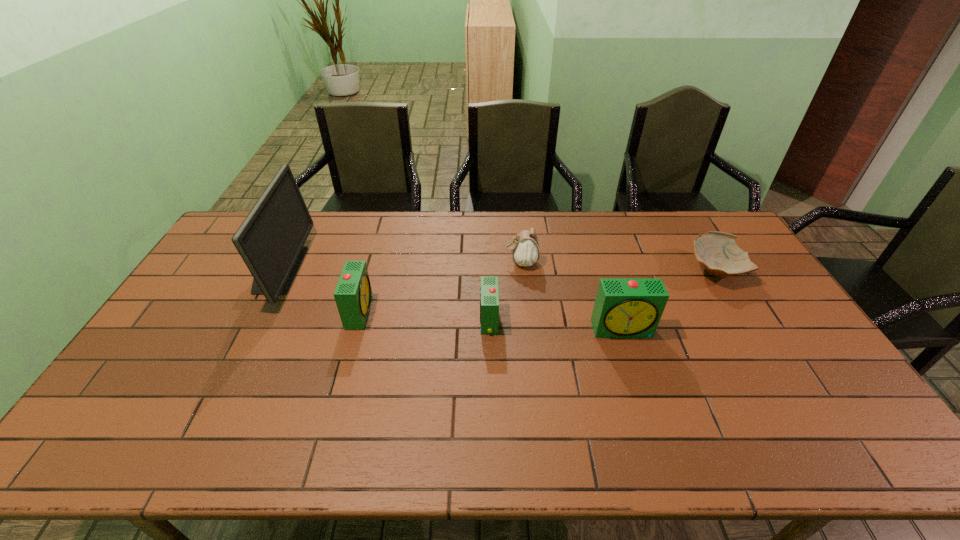
What are the coordinates of `free spot between the shortest alarm clock and the tallest object` in the screenshot? It's located at tap(383, 295).

Identify the location of free spot between the rightmost object and the fifth object from right to left. [x=538, y=291].

I want to click on vacant area that lies between the shortest alarm clock and the pouch, so click(x=505, y=291).

Locate an element on the screen. free space between the second alarm clock from left to right and the rightmost alarm clock is located at coordinates (556, 325).

Where is `object that is the third closest to the leftmost alarm clock`? This screenshot has height=540, width=960. object that is the third closest to the leftmost alarm clock is located at coordinates (525, 247).

Locate which object is the second closest to the tallest object. Please provide its 2D coordinates. Your answer should be formatted as a tuple, i.e. [(x, y)], where the tuple contains the x and y coordinates of a point satisfying the conditions above.

[(489, 294)]

This screenshot has width=960, height=540. I want to click on alarm clock that is the closest one to the shortest alarm clock, so 624,307.

Select which alarm clock is the second closest to the second object from right to left. Please provide its 2D coordinates. Your answer should be formatted as a tuple, i.e. [(x, y)], where the tuple contains the x and y coordinates of a point satisfying the conditions above.

[(353, 294)]

Locate an element on the screen. This screenshot has width=960, height=540. vacant space that satisfies the following two spatial constraints: 1. on the back side of the shortest object; 2. on the front-facing side of the third object from right to left is located at coordinates (710, 262).

The width and height of the screenshot is (960, 540). I want to click on free space that satisfies the following two spatial constraints: 1. on the screen side of the computer monitor; 2. on the left side of the rightmost object, so coord(278,270).